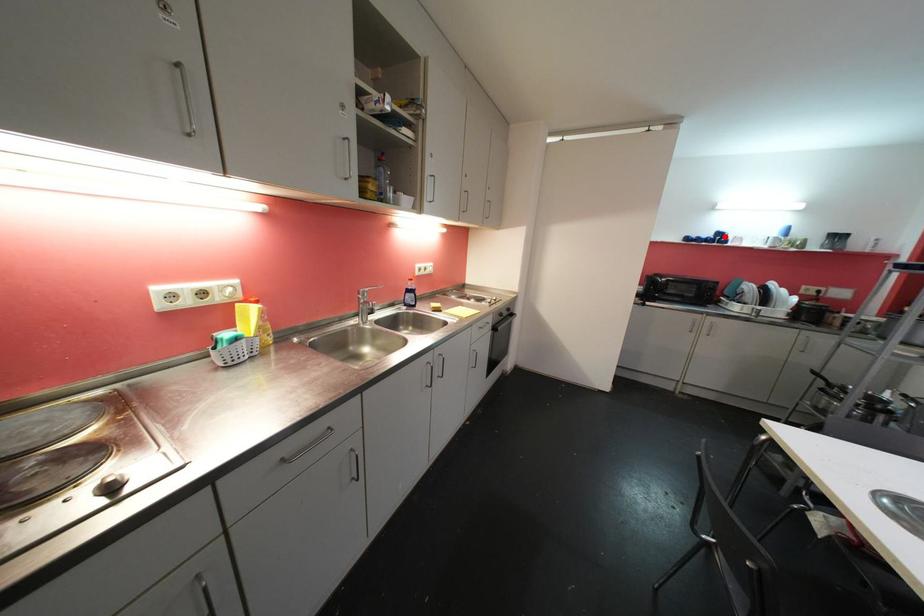
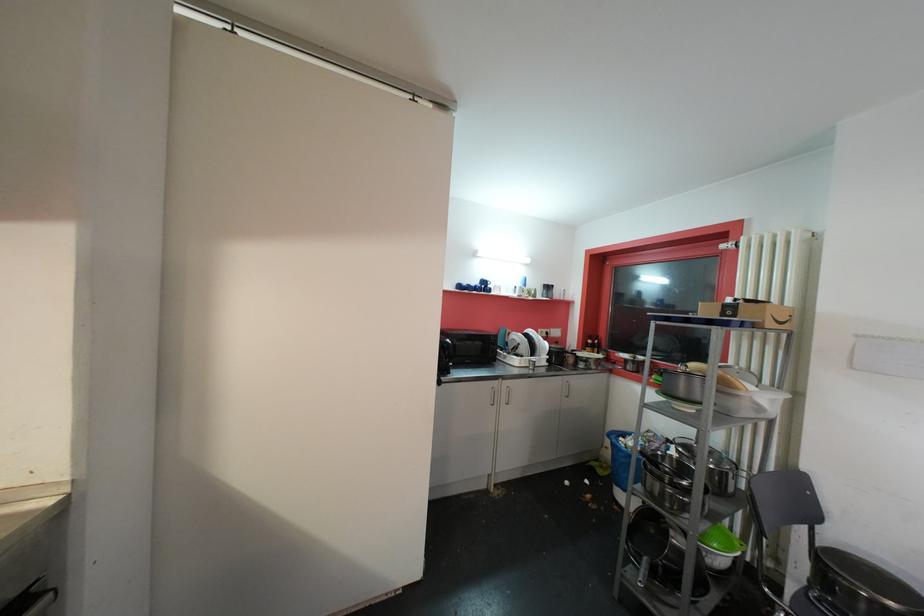
In the second image, find the point that corresponds to the highlighted location in the first image.

(489, 285)